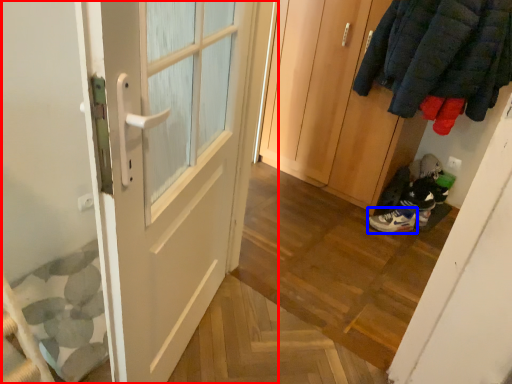
Question: Which point is further to the camera, door (highlighted by a red box) or footwear (highlighted by a blue box)?

Choices:
 (A) door
 (B) footwear

Answer: (B)